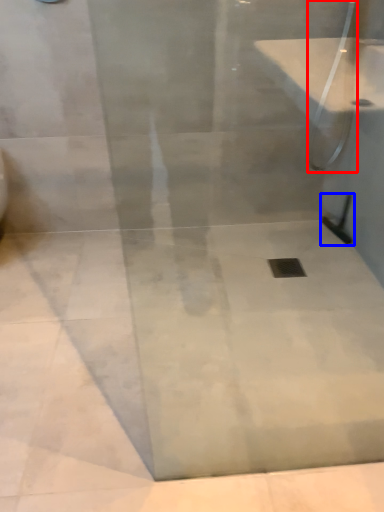
Question: Which object appears closest to the camera in this image, shower (highlighted by a red box) or shower (highlighted by a blue box)?

Choices:
 (A) shower
 (B) shower

Answer: (A)